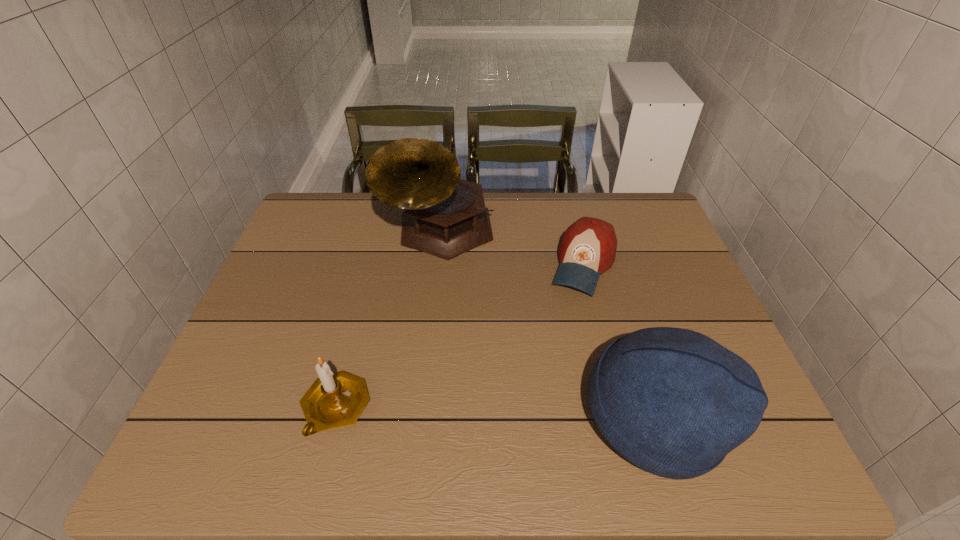
In the image, there is a desktop. Find the location of `free space at the right edge`. free space at the right edge is located at coordinates (687, 306).

Image resolution: width=960 pixels, height=540 pixels. I want to click on free region at the far left corner of the desktop, so click(319, 198).

Identify the location of vacant space at the far right corner of the desktop. This screenshot has height=540, width=960. (619, 206).

Find the location of a particular element. vacant area that lies between the second shortest object and the shortest object is located at coordinates pos(460,336).

Locate an element on the screen. This screenshot has height=540, width=960. vacant region between the second shortest object and the baseball cap is located at coordinates (460, 336).

This screenshot has height=540, width=960. Identify the location of empty space that is in between the tallest object and the candle holder. (388, 320).

This screenshot has width=960, height=540. I want to click on vacant region between the second tallest object and the tallest object, so click(x=547, y=324).

You are a GUI agent. You are given a task and a screenshot of the screen. Output one action in this format:
    pyautogui.click(x=<x>, y=<y>)
    Task: Click on the vacant space that's between the phonograph record and the shortest object
    This screenshot has height=540, width=960.
    Given the screenshot: What is the action you would take?
    pyautogui.click(x=512, y=247)

Find the location of `free spot between the second shortest object and the baseball cap`. free spot between the second shortest object and the baseball cap is located at coordinates (460, 336).

You are a GUI agent. You are given a task and a screenshot of the screen. Output one action in this format:
    pyautogui.click(x=<x>, y=<y>)
    Task: Click on the blank region between the third tallest object and the phonograph record
    The image size is (960, 540).
    Given the screenshot: What is the action you would take?
    pyautogui.click(x=388, y=320)